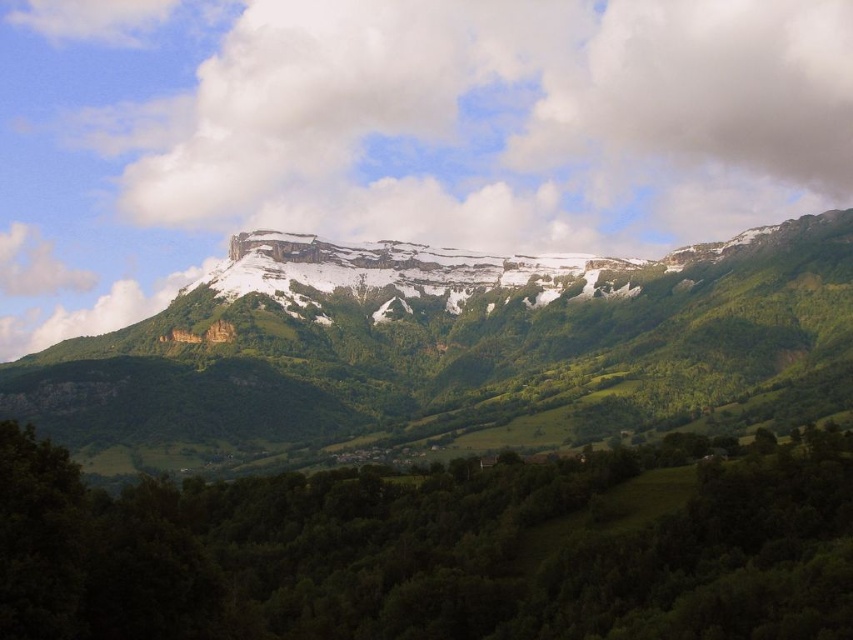
Does white fluffy cloud at upper center come behind green leafy trees at lower center?

That is True.

The height and width of the screenshot is (640, 853). Identify the location of white fluffy cloud at upper center. (524, 120).

What do you see at coordinates (524, 120) in the screenshot?
I see `white fluffy cloud at upper center` at bounding box center [524, 120].

Identify the location of white fluffy cloud at upper center. Image resolution: width=853 pixels, height=640 pixels. (524, 120).

Between point (202, 205) and point (743, 321), which one is positioned in front?

Point (743, 321) is in front.

Is white fluffy cloud at upper center bigger than snowy rock formation at upper center?

No.

The image size is (853, 640). In order to click on white fluffy cloud at upper center in this screenshot , I will do `click(524, 120)`.

Describe the element at coordinates (424, 554) in the screenshot. This screenshot has width=853, height=640. I see `green leafy trees at lower center` at that location.

Does point (57, 477) come in front of point (316, 336)?

Yes, point (57, 477) is closer to viewer.

The height and width of the screenshot is (640, 853). Find the location of `green leafy trees at lower center`. green leafy trees at lower center is located at coordinates (424, 554).